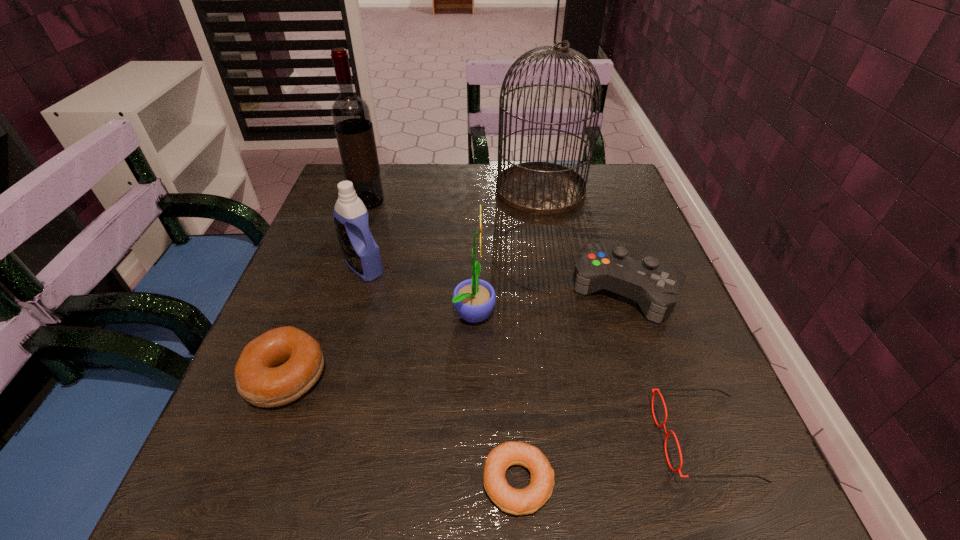
Identify the location of free space located on the left of the birdcage. The width and height of the screenshot is (960, 540). (374, 190).

I want to click on free point located 0.090m on the back of the wine bottle, so click(377, 175).

Where is `vacant space located 0.260m on the front-facing side of the sunflower`? The height and width of the screenshot is (540, 960). vacant space located 0.260m on the front-facing side of the sunflower is located at coordinates (631, 312).

Find the location of `blank space located on the right of the detergent`. blank space located on the right of the detergent is located at coordinates (461, 267).

I want to click on blank space located on the back of the fourth shortest object, so click(598, 214).

This screenshot has width=960, height=540. Find the location of `vacant space located on the right of the farther bagel`. vacant space located on the right of the farther bagel is located at coordinates (361, 376).

This screenshot has height=540, width=960. Identify the location of vacant area located 0.200m on the front-facing side of the seventh tallest object. (526, 439).

Find the location of a particular element. Image resolution: width=960 pixels, height=540 pixels. free region located 0.100m on the front-facing side of the seventh tallest object is located at coordinates (592, 439).

Identify the location of vacant space located 0.350m on the front-facing side of the seventh tallest object. (425, 439).

Find the location of a particular element. The height and width of the screenshot is (540, 960). vacant position located on the left of the shortest object is located at coordinates 281,482.